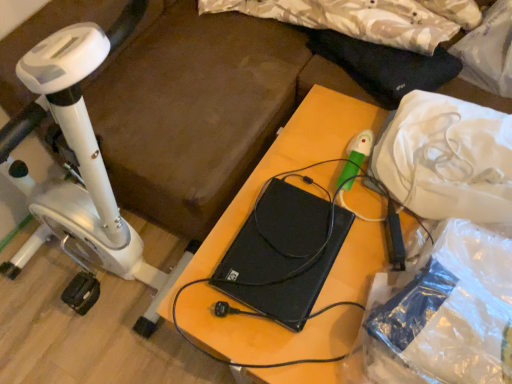
Question: Does white plastic stationary bicycle at left have a larger size compared to black matte laptop at center?

Choices:
 (A) no
 (B) yes

Answer: (B)

Question: Is white plastic stationary bicycle at left facing towards black matte laptop at center?

Choices:
 (A) yes
 (B) no

Answer: (A)

Question: From a real-world perspective, is white plastic stationary bicycle at left below black matte laptop at center?

Choices:
 (A) no
 (B) yes

Answer: (A)

Question: From a real-world perspective, does white plastic stationary bicycle at left stand above black matte laptop at center?

Choices:
 (A) no
 (B) yes

Answer: (B)

Question: From the image's perspective, is white plastic stationary bicycle at left over black matte laptop at center?

Choices:
 (A) yes
 (B) no

Answer: (A)

Question: From the image's perspective, is black matte laptop at center positioned above or below white plastic stationary bicycle at left?

Choices:
 (A) above
 (B) below

Answer: (B)

Question: Based on their sizes in the image, would you say black matte laptop at center is bigger or smaller than white plastic stationary bicycle at left?

Choices:
 (A) small
 (B) big

Answer: (A)

Question: Is black matte laptop at center inside or outside of white plastic stationary bicycle at left?

Choices:
 (A) inside
 (B) outside

Answer: (B)

Question: Looking at their shapes, would you say black matte laptop at center is wider or thinner than white plastic stationary bicycle at left?

Choices:
 (A) thin
 (B) wide

Answer: (A)

Question: In terms of size, does black matte laptop at center appear bigger or smaller than black matte laptop at center?

Choices:
 (A) small
 (B) big

Answer: (A)

Question: In the image, is black matte laptop at center positioned in front of or behind black matte laptop at center?

Choices:
 (A) front
 (B) behind

Answer: (B)

Question: Considering the positions of black matte laptop at center and black matte laptop at center in the image, is black matte laptop at center wider or thinner than black matte laptop at center?

Choices:
 (A) thin
 (B) wide

Answer: (A)

Question: From the image's perspective, relative to black matte laptop at center, is black matte laptop at center above or below?

Choices:
 (A) above
 (B) below

Answer: (A)

Question: Is black matte laptop at center to the left or to the right of white plastic bag at upper right in the image?

Choices:
 (A) left
 (B) right

Answer: (A)

Question: Is point (179, 297) positioned closer to the camera than point (421, 120)?

Choices:
 (A) closer
 (B) farther

Answer: (A)